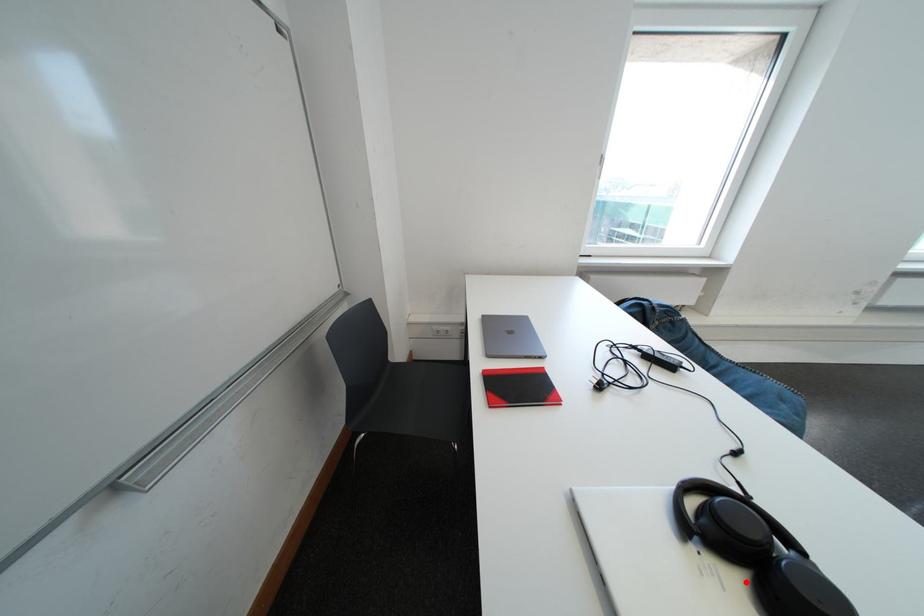
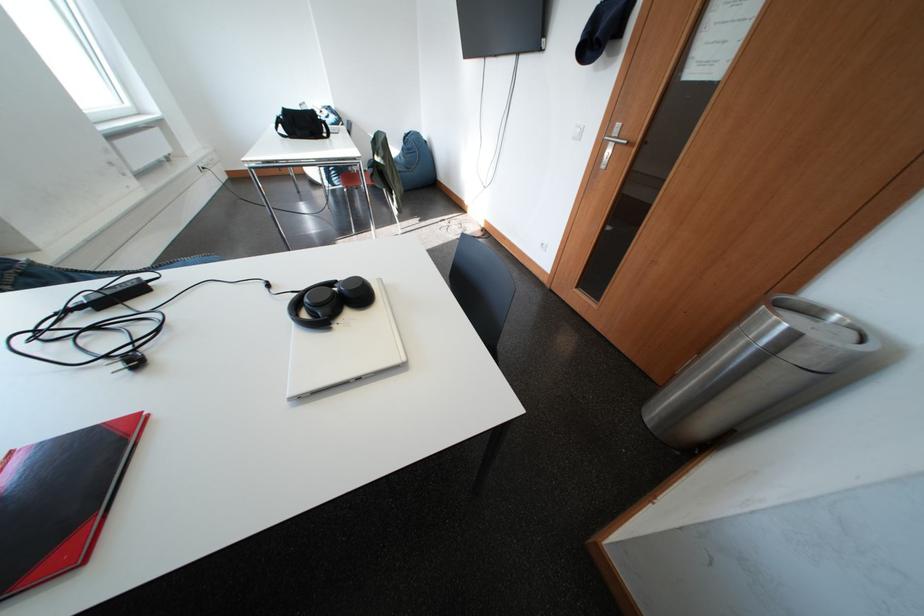
Find the pixel in the second image that matches the highlighted location in the first image.

(359, 318)